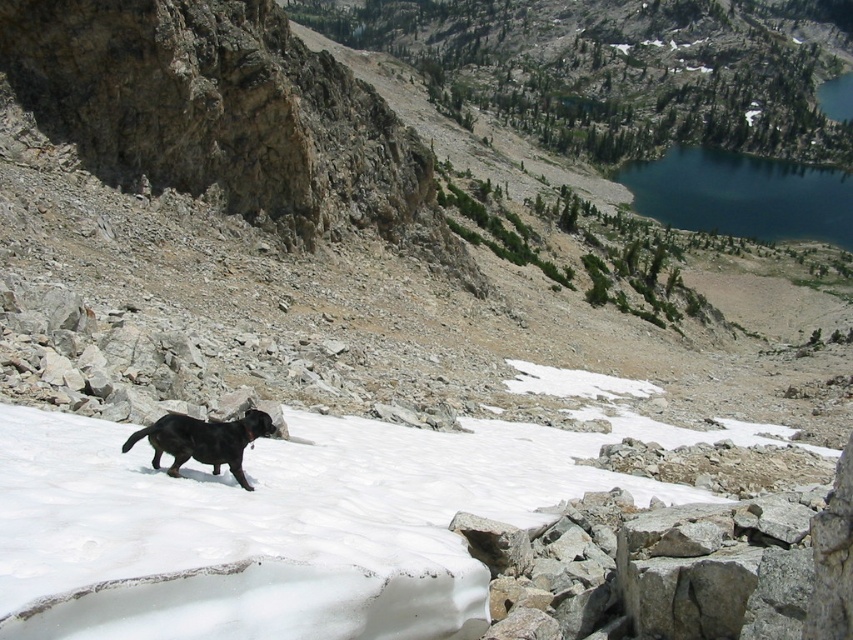
You are a hiker trying to reach the deep blue water at upper right from your current position near the shiny black dog at lower left. Which direction should you head to reach the water?

The deep blue water at upper right is to the right of the shiny black dog at lower left, so you should head towards the right to reach it.

You are a hiker planning to descend from the deep blue water at upper right to the shiny black dog at lower left. Which direction should you head to reach the dog?

The deep blue water at upper right is positioned over the shiny black dog at lower left, so to descend from the water to the dog, you should head downward and to the left.